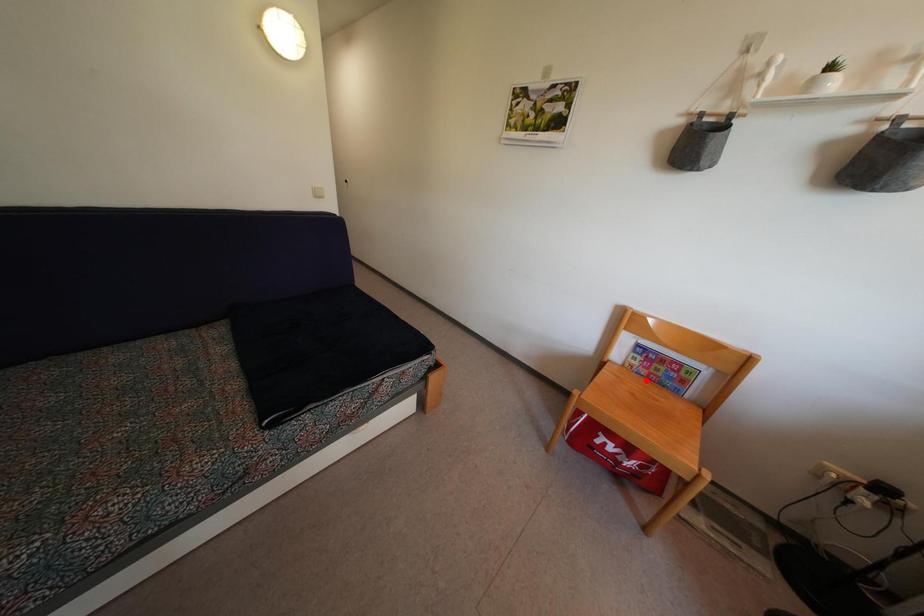
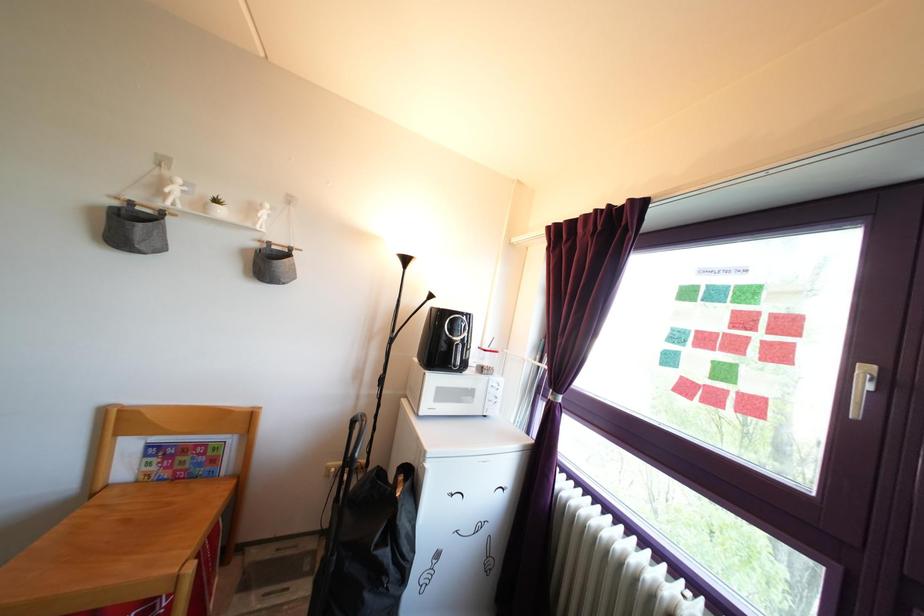
Where in the second image is the point corresponding to the highlighted location from the first image?

(169, 483)